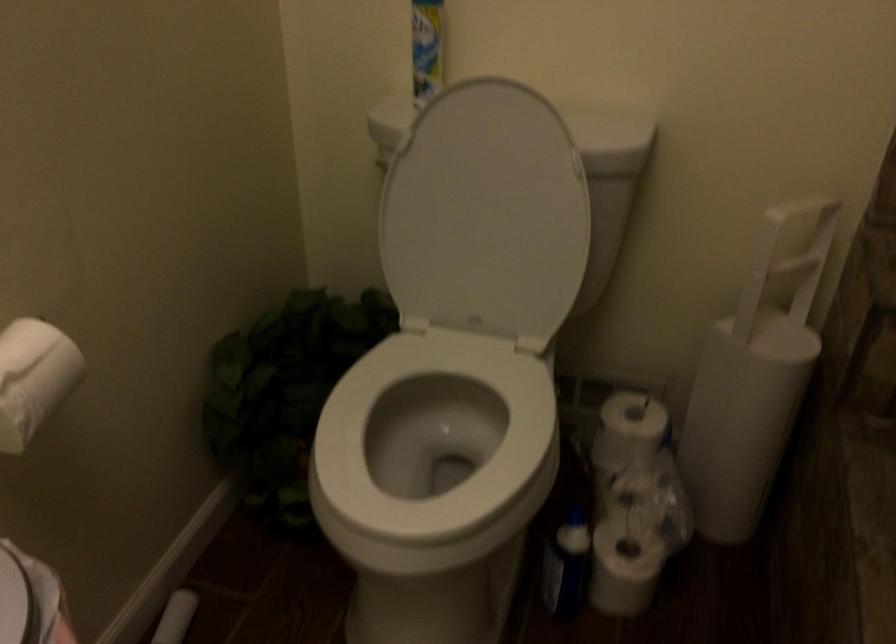
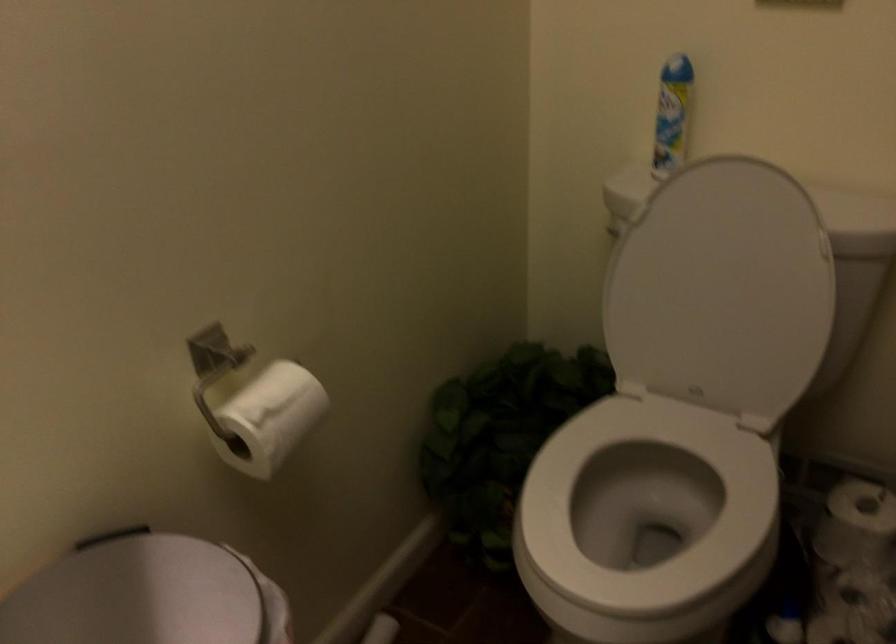
What movement of the cameraman would produce the second image?

The cameraman moved toward left, backward.